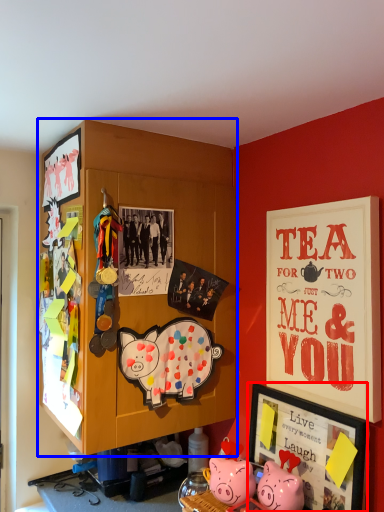
Question: Among these objects, which one is nearest to the camera, picture frame (highlighted by a red box) or cabinetry (highlighted by a blue box)?

Choices:
 (A) picture frame
 (B) cabinetry

Answer: (A)